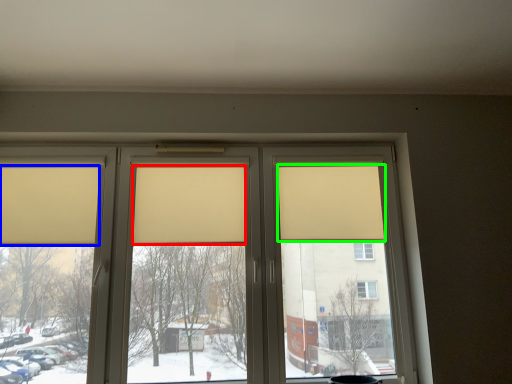
Question: Considering the real-world distances, which object is closest to curtain (highlighted by a red box)? curtain (highlighted by a blue box) or curtain (highlighted by a green box).

Choices:
 (A) curtain
 (B) curtain

Answer: (A)